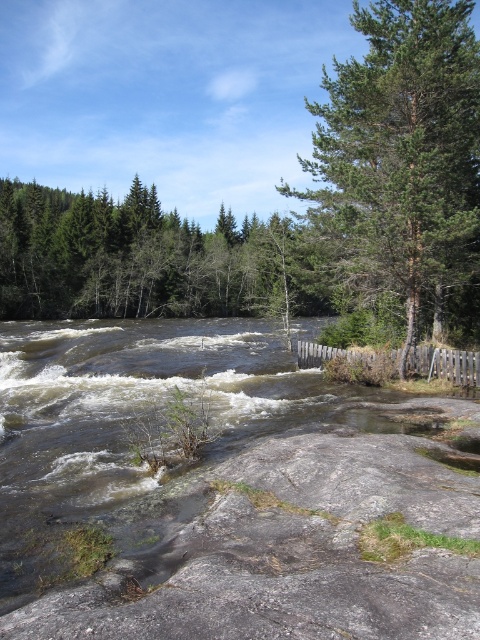
Question: Which of these objects is positioned farthest from the green textured tree at upper right?

Choices:
 (A) green matte tree at upper left
 (B) gray rough rock at center

Answer: (A)

Question: Among these objects, which one is farthest from the camera?

Choices:
 (A) gray rough rock at center
 (B) green textured tree at upper right
 (C) green matte tree at upper left

Answer: (C)

Question: Considering the relative positions of gray rough rock at center and green matte tree at upper left in the image provided, where is gray rough rock at center located with respect to green matte tree at upper left?

Choices:
 (A) above
 (B) below

Answer: (B)

Question: Among these objects, which one is farthest from the camera?

Choices:
 (A) gray rough rock at center
 (B) green textured tree at upper right

Answer: (B)

Question: Does green textured tree at upper right come behind green matte tree at upper left?

Choices:
 (A) no
 (B) yes

Answer: (A)

Question: Does gray rough rock at center lie behind green textured tree at upper right?

Choices:
 (A) no
 (B) yes

Answer: (A)